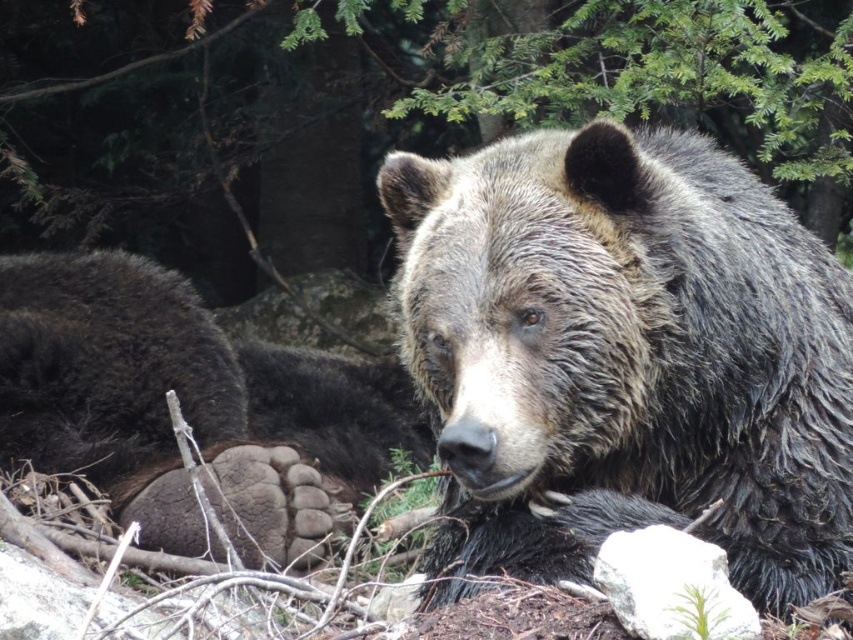
Is brown fur bear at center shorter than brown fur paw at center?

Indeed, brown fur bear at center has a lesser height compared to brown fur paw at center.

Is brown fur bear at center bigger than brown fur paw at center?

Incorrect, brown fur bear at center is not larger than brown fur paw at center.

Does point (688, 365) come closer to viewer compared to point (62, 404)?

Yes, it is.

The width and height of the screenshot is (853, 640). In order to click on brown fur bear at center in this screenshot , I will do `click(625, 355)`.